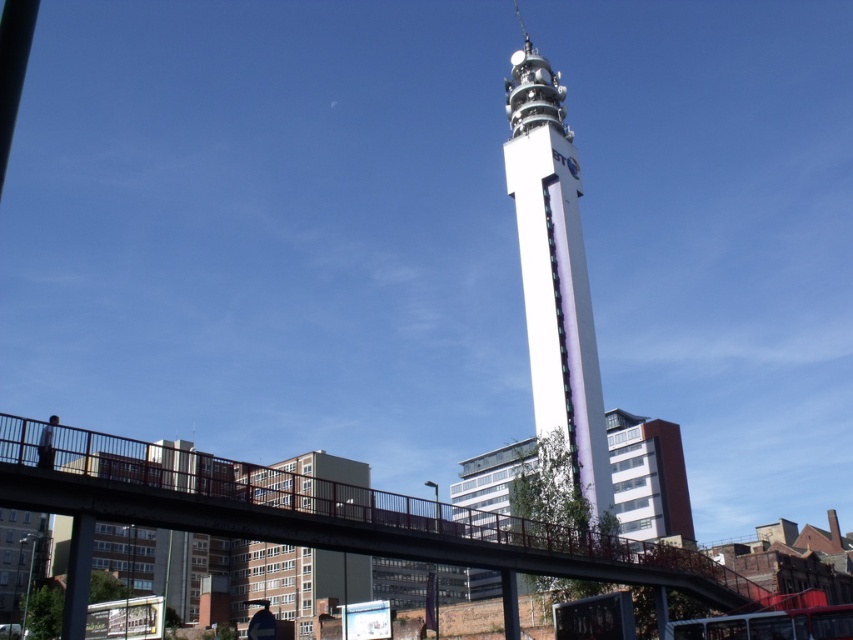
Question: In this image, where is white smooth tower at center located relative to metallic silver helmet at lower left?

Choices:
 (A) above
 (B) below

Answer: (A)

Question: Is white smooth tower at center positioned before metallic silver helmet at lower left?

Choices:
 (A) yes
 (B) no

Answer: (B)

Question: Among these objects, which one is farthest from the camera?

Choices:
 (A) metallic silver helmet at lower left
 (B) white smooth tower at center

Answer: (B)

Question: Is white smooth tower at center positioned at the back of metallic silver helmet at lower left?

Choices:
 (A) yes
 (B) no

Answer: (A)